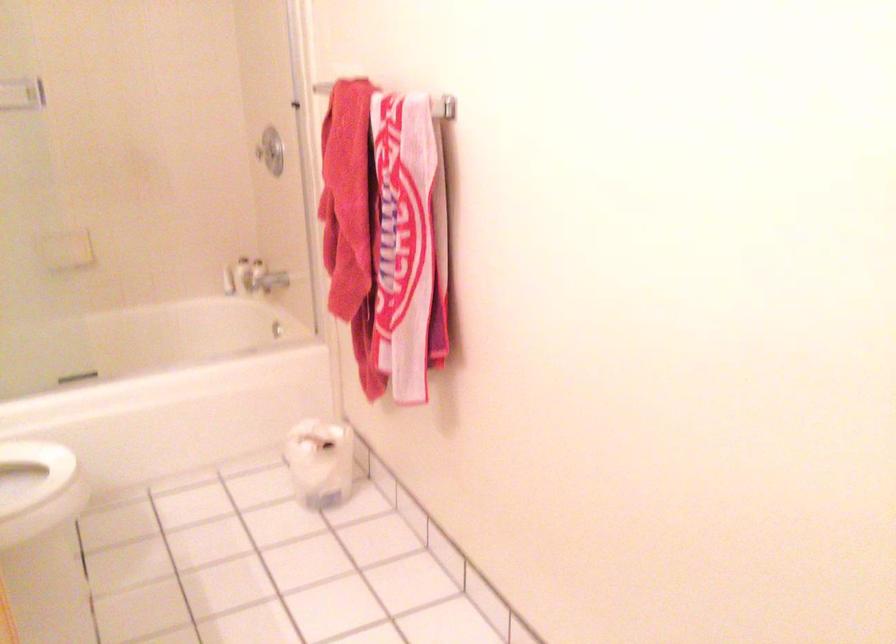
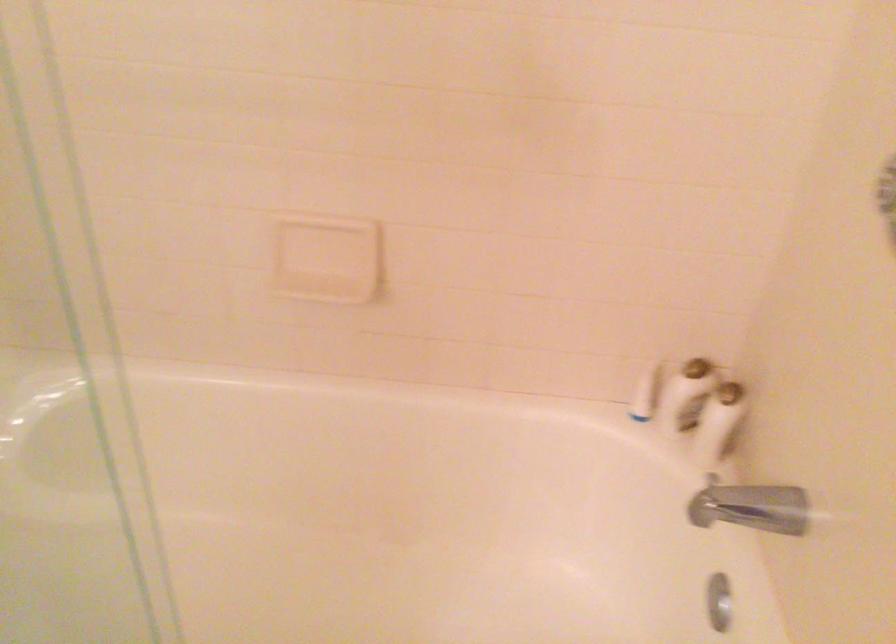
Locate, in the second image, the point that corresponds to point 228,277 in the first image.

(644, 393)